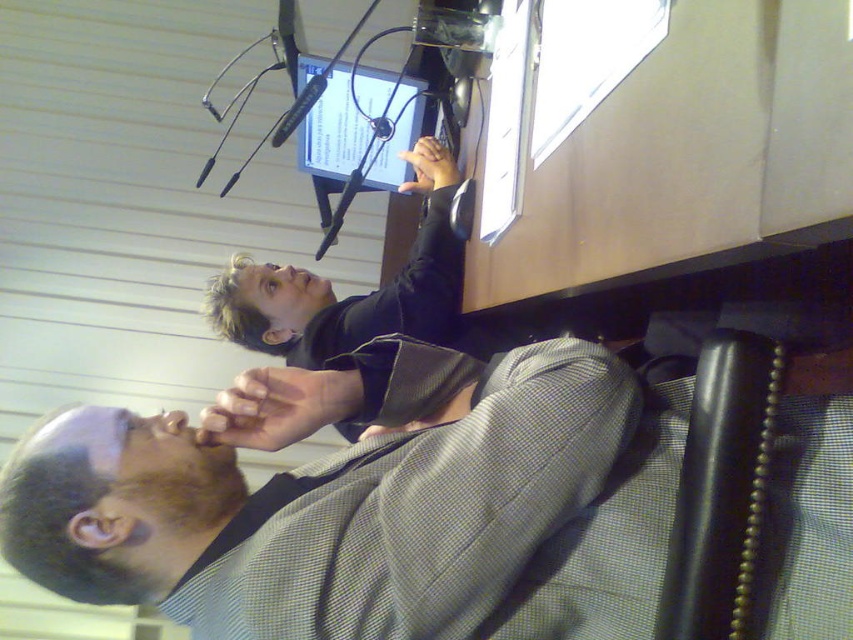
Question: Is matte black jacket at upper center smaller than matte black monitor at center?

Choices:
 (A) yes
 (B) no

Answer: (B)

Question: Which object appears farthest from the camera in this image?

Choices:
 (A) matte black monitor at center
 (B) matte black jacket at upper center

Answer: (A)

Question: In this image, where is matte black jacket at upper center located relative to matte black monitor at center?

Choices:
 (A) left
 (B) right

Answer: (A)

Question: Which point is closer to the camera?

Choices:
 (A) matte black monitor at center
 (B) matte black jacket at upper center

Answer: (B)

Question: Is matte black jacket at upper center below matte black monitor at center?

Choices:
 (A) yes
 (B) no

Answer: (A)

Question: Which object appears closest to the camera in this image?

Choices:
 (A) matte black monitor at center
 (B) matte black jacket at upper center

Answer: (B)